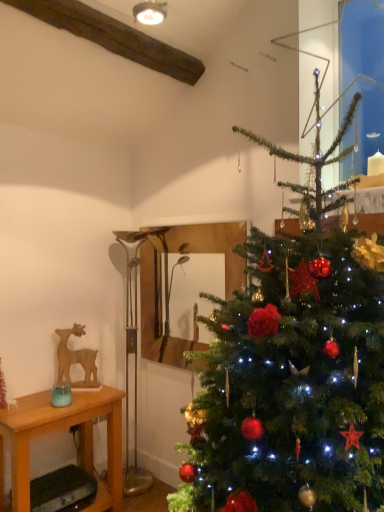
Question: Is green matte christmas tree at right taller or shorter than wooden table at left?

Choices:
 (A) tall
 (B) short

Answer: (A)

Question: Looking at their shapes, would you say green matte christmas tree at right is wider or thinner than wooden table at left?

Choices:
 (A) wide
 (B) thin

Answer: (A)

Question: Which object is the farthest from the wooden table at left?

Choices:
 (A) green matte christmas tree at right
 (B) wooden mirror at center
 (C) wooden deer at left

Answer: (A)

Question: Estimate the real-world distances between objects in this image. Which object is closer to the wooden mirror at center?

Choices:
 (A) wooden table at left
 (B) green matte christmas tree at right
 (C) wooden deer at left

Answer: (C)